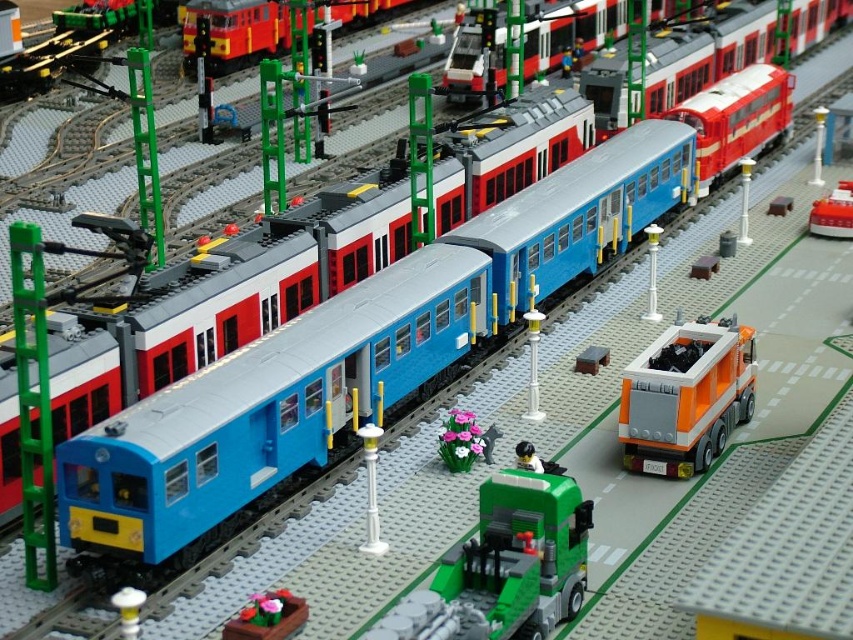
Question: Among these objects, which one is farthest from the camera?

Choices:
 (A) orange matte truck at center-right
 (B) smooth pink flower pot at lower center
 (C) green matte truck at center
 (D) smooth red truck at center right

Answer: (D)

Question: Does green matte truck at center lie in front of white glossy lamp post at lower left?

Choices:
 (A) no
 (B) yes

Answer: (B)

Question: Does green matte truck at center have a lesser width compared to smooth red truck at center right?

Choices:
 (A) yes
 (B) no

Answer: (B)

Question: Estimate the real-world distances between objects in this image. Which object is farther from the smooth pink flower pot at lower center?

Choices:
 (A) green matte truck at center
 (B) brick red train at upper center
 (C) white glossy lamp post at lower left
 (D) orange matte truck at center-right

Answer: (B)

Question: Can you confirm if orange matte truck at center-right is positioned to the right of smooth red truck at center right?

Choices:
 (A) yes
 (B) no

Answer: (B)

Question: Which point is closer to the camera taking this photo?

Choices:
 (A) (843, 225)
 (B) (502, 592)
 (C) (695, 404)

Answer: (B)